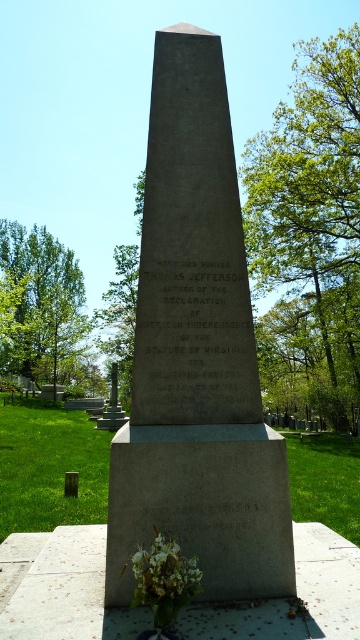
You are a visitor at the cemetery and want to take a photo of the obelisk monument. You notice the green leafy tree at left and the white matte flowers at lower center in your frame. Which object will appear larger in your photo?

The green leafy tree at left will appear larger in the photo because it has a greater height compared to the white matte flowers at lower center.

You are standing in front of the monument and want to place a new bouquet of flowers to the right of the existing white matte flowers at lower center. Which direction should you move relative to the green leafy tree at left to place the new bouquet?

To place the new bouquet to the right of the white matte flowers at lower center, you should move to the right relative to the green leafy tree at left, since the tree is already positioned to the left of the existing flowers.

You are a visitor at the cemetery and want to take a photo of the gray stone monument at center without any obstructions. Is the green leafy tree at upper right blocking the view of the monument?

The gray stone monument at center is below the green leafy tree at upper right, so the tree is positioned above the monument and might block part of the view depending on the angle, but since it is at upper right, it might not fully obscure the monument. However, to ensure no obstruction, you should position yourself so the tree is out of the frame or adjust the angle to avoid it.